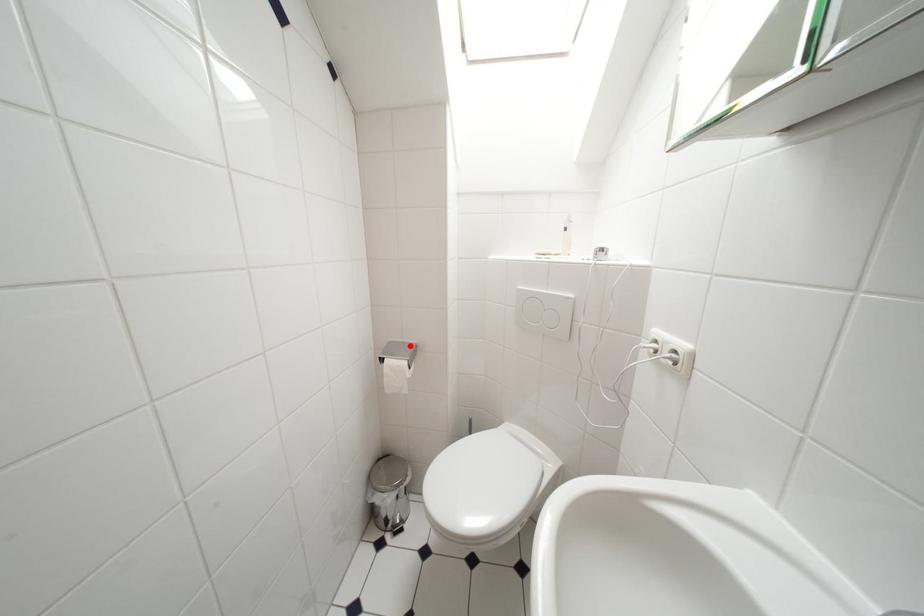
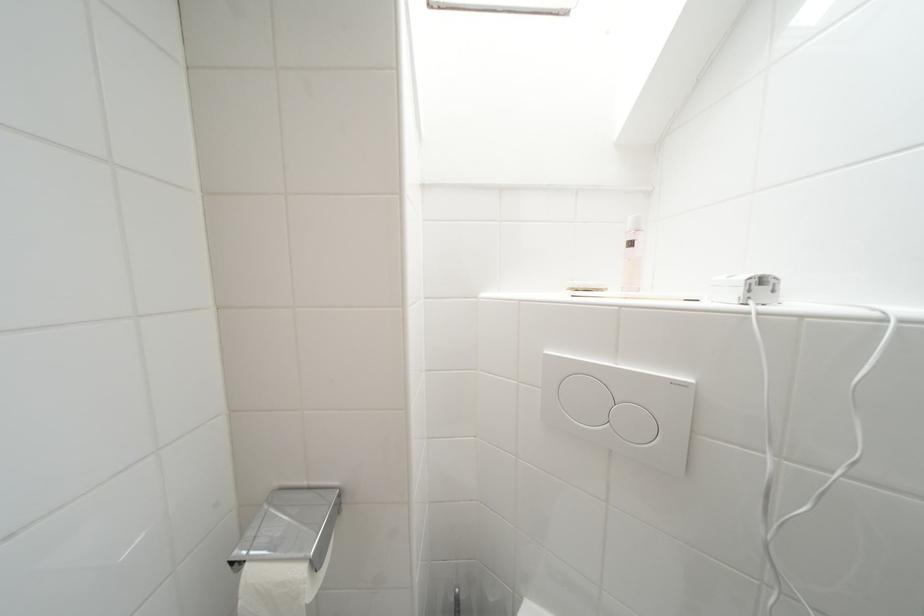
The point at the highlighted location is marked in the first image. Where is the corresponding point in the second image?

(315, 491)